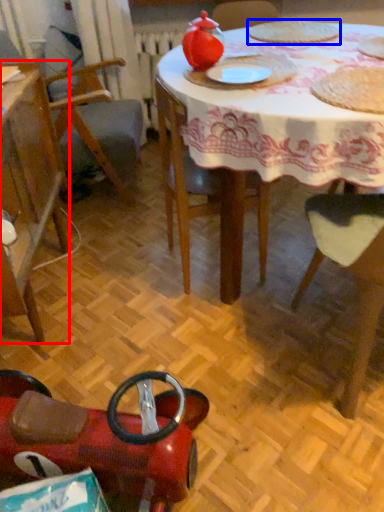
Question: Which of the following is the closest to the observer, chair (highlighted by a red box) or food (highlighted by a blue box)?

Choices:
 (A) chair
 (B) food

Answer: (A)